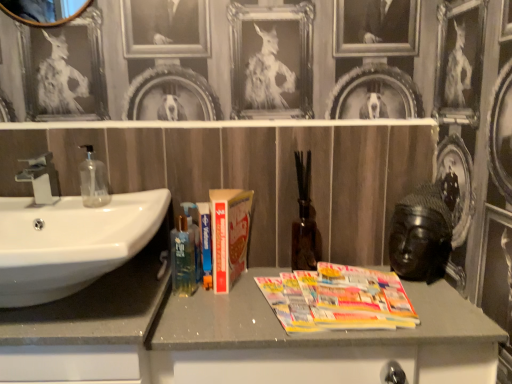
The image size is (512, 384). I want to click on vacant area located to the right-hand side of transparent glass soap dispenser at left, so tap(140, 203).